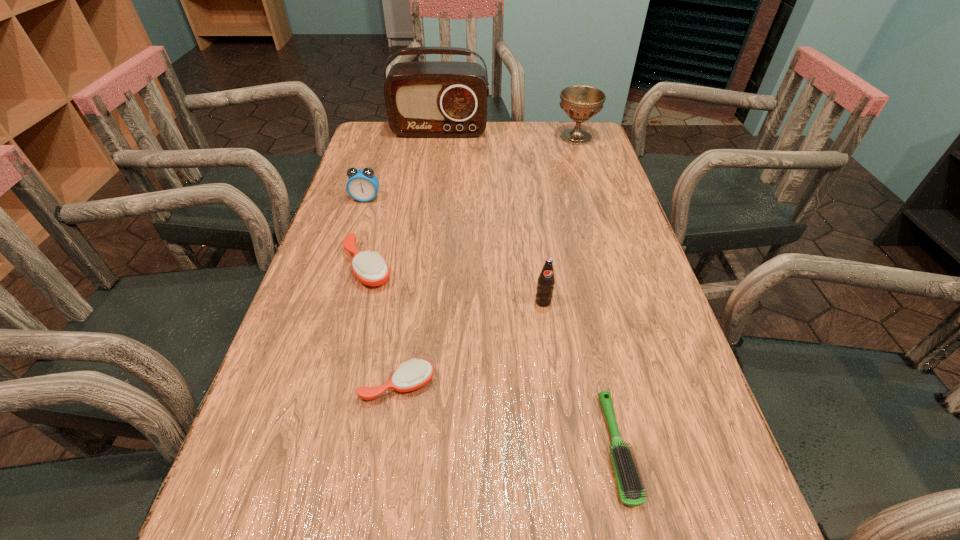
Identify the location of chalice present at the far edge. (580, 103).

Find the location of a particular element. radio receiver located in the left edge section of the desktop is located at coordinates (427, 99).

Find the location of `alarm clock that is at the left edge`. alarm clock that is at the left edge is located at coordinates (362, 185).

Locate an element on the screen. The image size is (960, 540). hairbrush that is at the left edge is located at coordinates (371, 269).

The width and height of the screenshot is (960, 540). What are the coordinates of `chalice that is at the right edge` in the screenshot? It's located at click(580, 103).

Identify the location of hairbrush situated at the right edge. Image resolution: width=960 pixels, height=540 pixels. coord(629,485).

Where is `object located at the far left corner`? The width and height of the screenshot is (960, 540). object located at the far left corner is located at coordinates (427, 99).

This screenshot has height=540, width=960. Find the location of `object that is at the far right corner`. object that is at the far right corner is located at coordinates click(x=580, y=103).

You are a GUI agent. You are given a task and a screenshot of the screen. Output one action in this format:
    pyautogui.click(x=<x>, y=<y>)
    Task: Click on the vacant space at the far edge of the desktop
    
    Given the screenshot: What is the action you would take?
    pyautogui.click(x=492, y=127)

You are a GUI agent. You are given a task and a screenshot of the screen. Output one action in this format:
    pyautogui.click(x=<x>, y=<y>)
    Task: Click on the vacant area at the left edge
    The height and width of the screenshot is (540, 960).
    Given the screenshot: What is the action you would take?
    pyautogui.click(x=318, y=378)